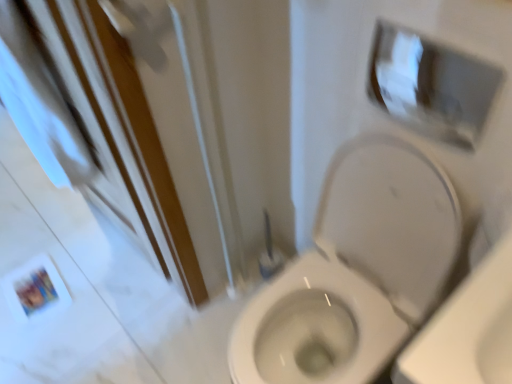
Question: Is there a large distance between white fabric screen door at lower left and white glossy toilet at center?

Choices:
 (A) no
 (B) yes

Answer: (A)

Question: Is white fabric screen door at lower left wider than white glossy toilet at center?

Choices:
 (A) yes
 (B) no

Answer: (B)

Question: From a real-world perspective, is white fabric screen door at lower left over white glossy toilet at center?

Choices:
 (A) no
 (B) yes

Answer: (B)

Question: Is the depth of white fabric screen door at lower left less than that of white glossy toilet at center?

Choices:
 (A) no
 (B) yes

Answer: (B)

Question: Could you tell me if white fabric screen door at lower left is facing white glossy toilet at center?

Choices:
 (A) no
 (B) yes

Answer: (A)

Question: Looking at their shapes, would you say white glossy toilet at center is wider or thinner than white fabric screen door at lower left?

Choices:
 (A) thin
 (B) wide

Answer: (B)

Question: Looking at the image, does white glossy toilet at center seem bigger or smaller compared to white fabric screen door at lower left?

Choices:
 (A) small
 (B) big

Answer: (B)

Question: Would you say white glossy toilet at center is inside or outside white fabric screen door at lower left?

Choices:
 (A) inside
 (B) outside

Answer: (B)

Question: Is white glossy toilet at center to the left or to the right of white fabric screen door at lower left in the image?

Choices:
 (A) left
 (B) right

Answer: (B)

Question: In terms of size, does white glossy medicine cabinet at upper right appear bigger or smaller than white fabric screen door at lower left?

Choices:
 (A) small
 (B) big

Answer: (A)

Question: Considering the relative positions of white glossy medicine cabinet at upper right and white fabric screen door at lower left in the image provided, is white glossy medicine cabinet at upper right to the left or to the right of white fabric screen door at lower left?

Choices:
 (A) left
 (B) right

Answer: (B)

Question: In terms of width, does white glossy medicine cabinet at upper right look wider or thinner when compared to white fabric screen door at lower left?

Choices:
 (A) wide
 (B) thin

Answer: (B)

Question: From the image's perspective, is white glossy medicine cabinet at upper right above or below white fabric screen door at lower left?

Choices:
 (A) below
 (B) above

Answer: (B)

Question: Based on their sizes in the image, would you say white fabric screen door at lower left is bigger or smaller than white glossy medicine cabinet at upper right?

Choices:
 (A) big
 (B) small

Answer: (A)

Question: From their relative heights in the image, would you say white fabric screen door at lower left is taller or shorter than white glossy medicine cabinet at upper right?

Choices:
 (A) short
 (B) tall

Answer: (B)